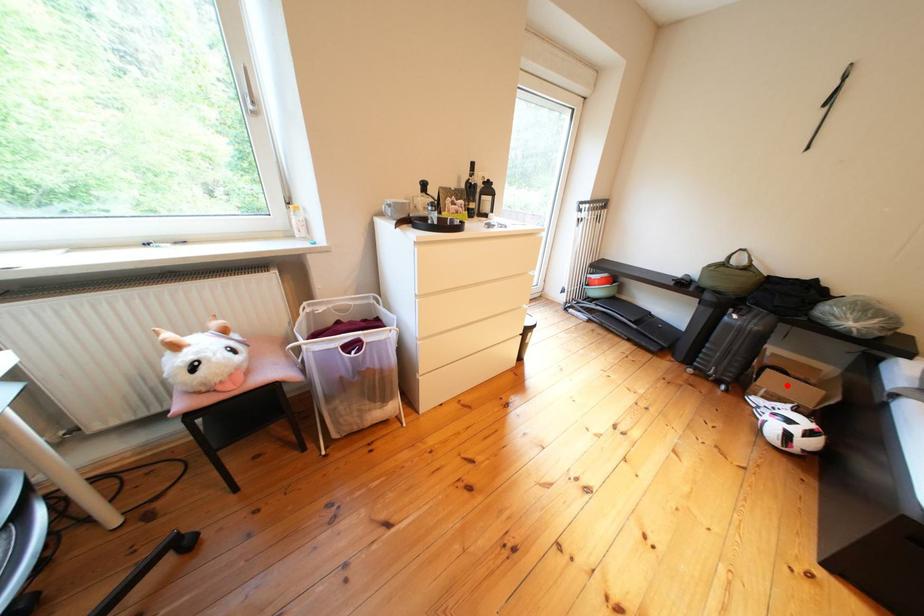
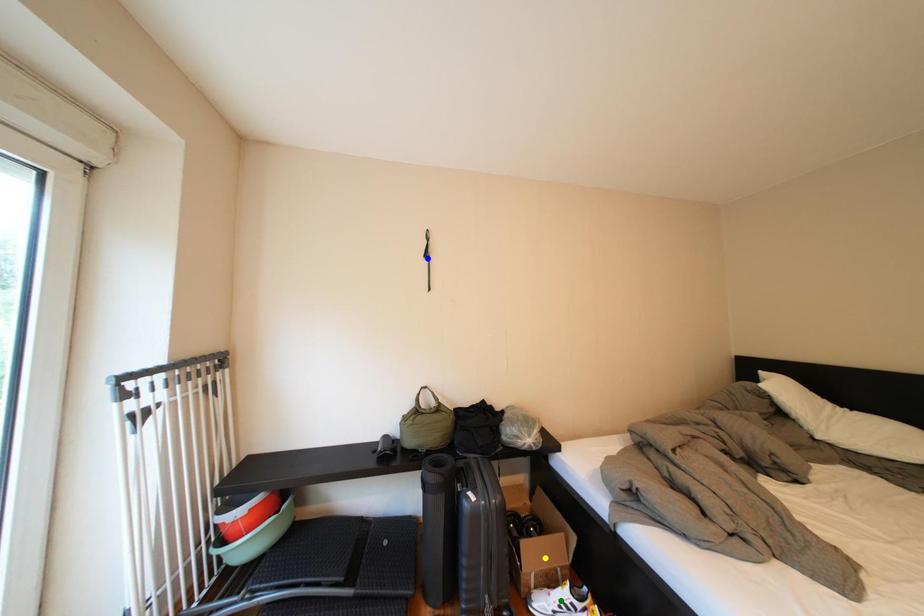
Question: I am providing you with two images of the same scene from different viewpoints. A red point is marked on the first image. You are given multiple points on the second image. Which point in image 2 represents the same 3d spot as the red point in image 1?

Choices:
 (A) blue point
 (B) yellow point
 (C) green point

Answer: (B)